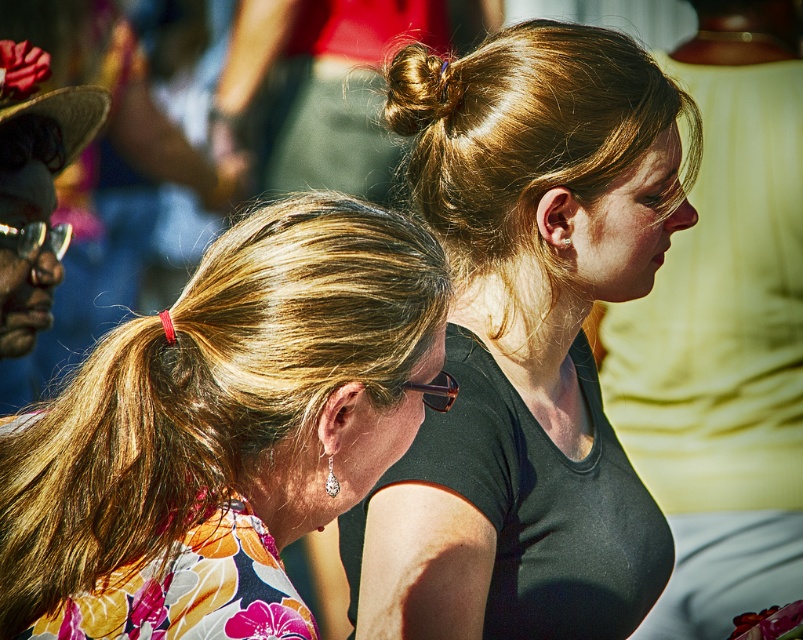
Does blonde hair at center have a greater width compared to black matte shirt at center?

Yes, blonde hair at center is wider than black matte shirt at center.

Does blonde hair at center appear on the left side of black matte shirt at center?

Correct, you'll find blonde hair at center to the left of black matte shirt at center.

Is point (218, 372) behind point (671, 476)?

That is False.

Find the location of a particular element. The image size is (803, 640). blonde hair at center is located at coordinates coord(222,432).

Which is below, black matte shirt at upper center or blonde hair at center?

Positioned lower is blonde hair at center.

Does black matte shirt at upper center have a greater width compared to blonde hair at center?

No.

Which is in front, point (577, 336) or point (340, 392)?

Point (340, 392) is more forward.

Where is `black matte shirt at upper center`? black matte shirt at upper center is located at coordinates (x=532, y=346).

Image resolution: width=803 pixels, height=640 pixels. In order to click on black matte shirt at center in this screenshot , I will do `click(724, 333)`.

Which is below, black matte shirt at center or golden shiny hair at upper center?

Positioned lower is black matte shirt at center.

Who is more distant from viewer, (777, 92) or (416, 106)?

The point (777, 92) is more distant.

Locate an element on the screen. The height and width of the screenshot is (640, 803). black matte shirt at center is located at coordinates (724, 333).